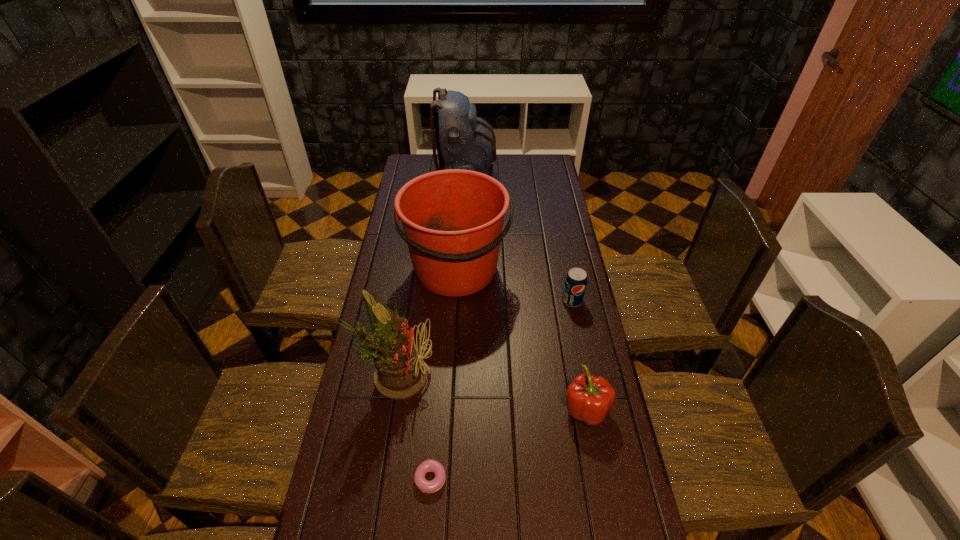
Identify the location of backpack. This screenshot has width=960, height=540. (464, 141).

Identify the location of flower arrangement. (401, 372).

You are a GUI agent. You are given a task and a screenshot of the screen. Output one action in this format:
    pyautogui.click(x=<x>, y=<y>)
    Task: Click on the bucket
    This screenshot has height=540, width=960.
    Given the screenshot: What is the action you would take?
    pyautogui.click(x=452, y=219)

Locate an element on the screen. This screenshot has height=540, width=960. pop is located at coordinates (575, 283).

I want to click on pepper, so click(589, 398).

You are a GUI agent. You are given a task and a screenshot of the screen. Output one action in this format:
    pyautogui.click(x=<x>, y=<y>)
    Task: Click on the shortest object
    This screenshot has width=960, height=540.
    Given the screenshot: What is the action you would take?
    pyautogui.click(x=430, y=465)

Image resolution: width=960 pixels, height=540 pixels. In order to click on doughnut in this screenshot , I will do `click(430, 465)`.

This screenshot has height=540, width=960. Identify the location of vacant point located 0.070m at the front pocket of the backpack. (510, 178).

Where is `blank space located 0.170m in front of the flower arrangement with the fan visible`? This screenshot has height=540, width=960. blank space located 0.170m in front of the flower arrangement with the fan visible is located at coordinates tap(488, 374).

Where is `blank space located 0.310m on the front of the bucket`? blank space located 0.310m on the front of the bucket is located at coordinates (452, 383).